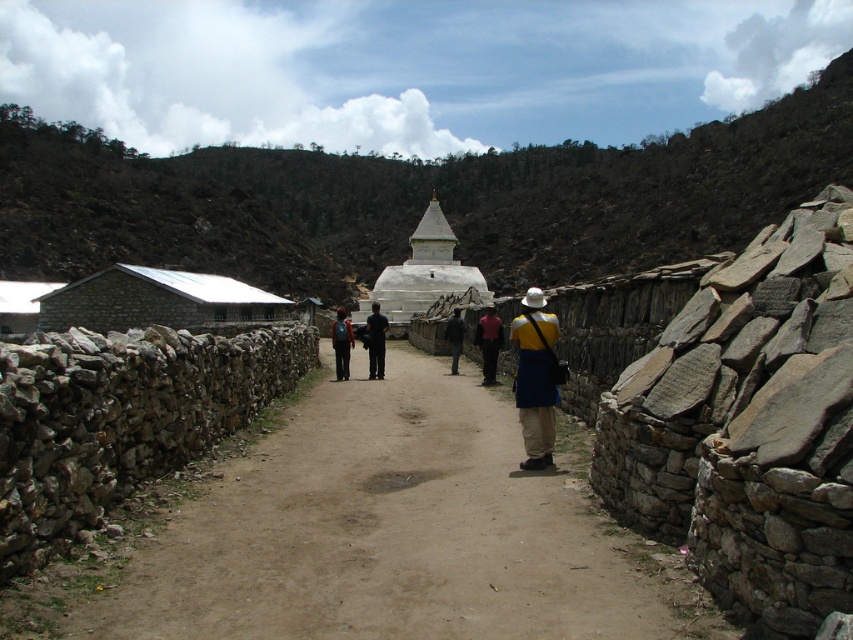
Question: Which point appears farthest from the camera in this image?

Choices:
 (A) (407, 273)
 (B) (345, 348)
 (C) (367, 317)

Answer: (A)

Question: Does dirt path at center have a larger size compared to dark blue fabric at center?

Choices:
 (A) yes
 (B) no

Answer: (A)

Question: Among these objects, which one is farthest from the camera?

Choices:
 (A) pink fabric at center
 (B) dirt path at center

Answer: (A)

Question: Which point is closer to the camera?

Choices:
 (A) pink fabric at center
 (B) yellow fabric at center

Answer: (B)

Question: Does dirt path at center lie behind yellow fabric at center?

Choices:
 (A) no
 (B) yes

Answer: (A)

Question: Does dirt path at center appear under black fabric pants at center?

Choices:
 (A) yes
 (B) no

Answer: (A)